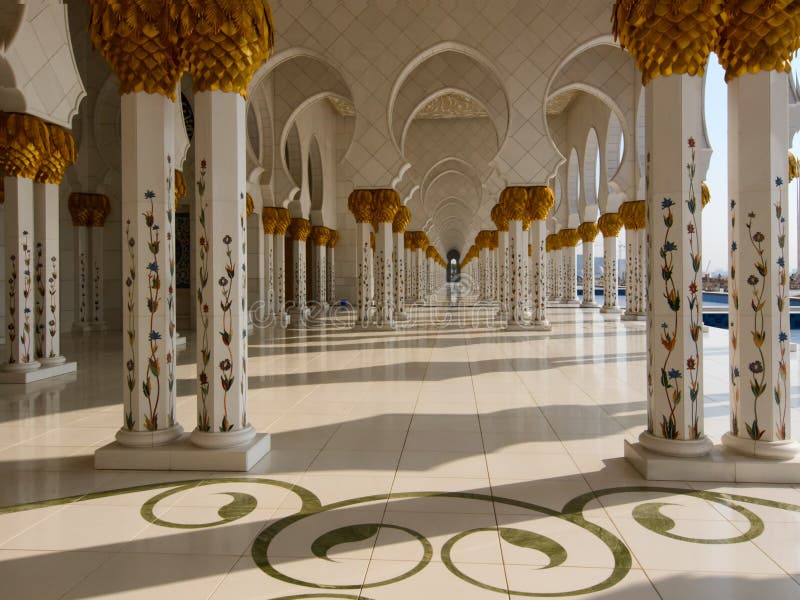
You are a GUI agent. You are given a task and a screenshot of the screen. Output one action in this format:
    pyautogui.click(x=<x>, y=<y>)
    Task: Click on the white columns with floral paintings in the foreground
    This screenshot has height=600, width=800.
    Given the screenshot: What is the action you would take?
    pyautogui.click(x=750, y=125), pyautogui.click(x=673, y=120), pyautogui.click(x=216, y=147), pyautogui.click(x=140, y=130), pyautogui.click(x=25, y=200), pyautogui.click(x=50, y=202)